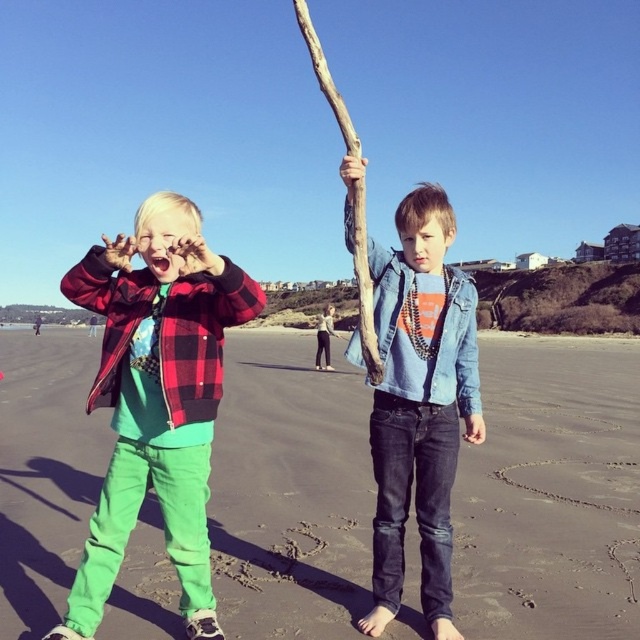
Question: Which point appears closest to the camera in this image?

Choices:
 (A) (x=413, y=376)
 (B) (x=529, y=355)
 (C) (x=362, y=282)

Answer: (C)

Question: Estimate the real-world distances between objects in this image. Which object is farther from the matte plaid jacket at left?

Choices:
 (A) denim jacket at center
 (B) green fabric pants at left

Answer: (B)

Question: Is matte plaid jacket at left positioned before denim jacket at center?

Choices:
 (A) no
 (B) yes

Answer: (B)

Question: Which of these objects is positioned closest to the brown rough branch at center?

Choices:
 (A) matte plaid jacket at left
 (B) green fabric pants at left

Answer: (A)

Question: Does denim jacket at center have a larger size compared to brown rough branch at center?

Choices:
 (A) yes
 (B) no

Answer: (B)

Question: Does green fabric pants at left appear on the right side of denim jacket at center?

Choices:
 (A) no
 (B) yes

Answer: (A)